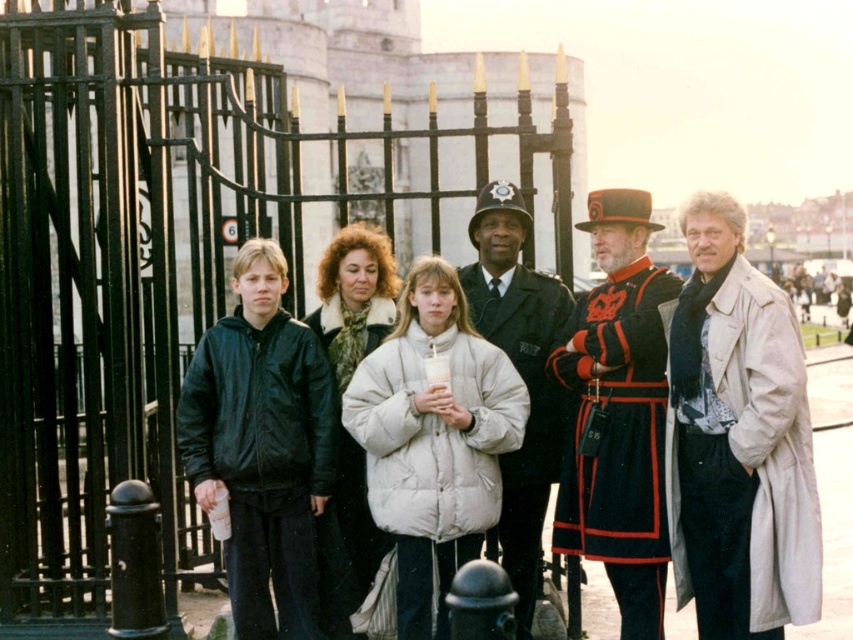
Question: Can you confirm if red velvet uniform at right is wider than white puffy coat at center?

Choices:
 (A) yes
 (B) no

Answer: (B)

Question: Considering the relative positions of white puffy coat at center and black uniform at center in the image provided, where is white puffy coat at center located with respect to black uniform at center?

Choices:
 (A) above
 (B) below

Answer: (B)

Question: Among these objects, which one is farthest from the camera?

Choices:
 (A) black uniform at center
 (B) white puffy coat at center

Answer: (B)

Question: Does white puffy coat at center have a larger size compared to velvet black uniform at center?

Choices:
 (A) no
 (B) yes

Answer: (A)

Question: Considering the real-world distances, which object is farthest from the black uniform at center?

Choices:
 (A) velvet black uniform at center
 (B) red velvet uniform at right

Answer: (B)

Question: Estimate the real-world distances between objects in this image. Which object is farther from the red velvet uniform at right?

Choices:
 (A) white puffy coat at center
 (B) velvet black uniform at center

Answer: (A)